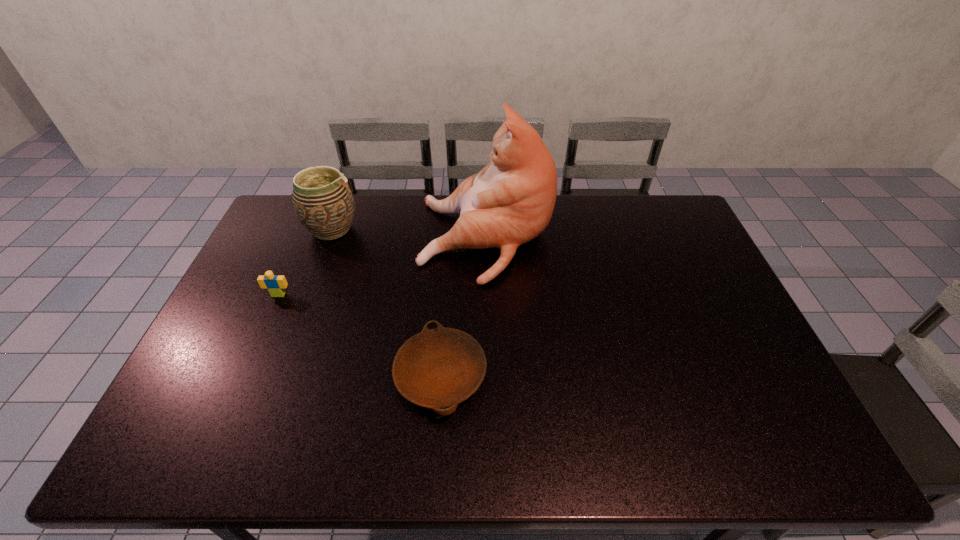
In order to click on cat in this screenshot , I will do `click(510, 201)`.

Where is `the second tallest object`? This screenshot has height=540, width=960. the second tallest object is located at coordinates (323, 202).

Where is `Lego`? Image resolution: width=960 pixels, height=540 pixels. Lego is located at coordinates (275, 283).

Image resolution: width=960 pixels, height=540 pixels. I want to click on the third tallest object, so click(275, 283).

The width and height of the screenshot is (960, 540). In order to click on the shortest object in this screenshot , I will do `click(438, 368)`.

Image resolution: width=960 pixels, height=540 pixels. What are the coordinates of `plate` in the screenshot? It's located at (438, 368).

What are the coordinates of `vacant space located 0.280m on the face of the tallest object` in the screenshot? It's located at (339, 240).

I want to click on vacant space located on the face of the tallest object, so click(330, 240).

Locate an element on the screen. vacant space located on the face of the tallest object is located at coordinates (394, 240).

The height and width of the screenshot is (540, 960). What are the coordinates of `blank space located 0.170m on the right of the third shortest object` in the screenshot? It's located at (407, 230).